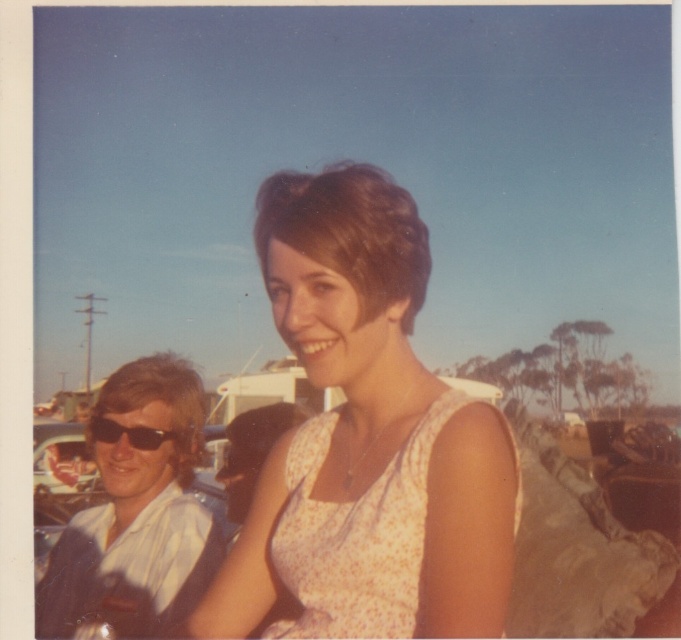
Who is taller, white shirt at left or black plastic sunglasses at left?

white shirt at left is taller.

Is white shirt at left bigger than black plastic sunglasses at left?

Indeed, white shirt at left has a larger size compared to black plastic sunglasses at left.

Is point (185, 563) closer to camera compared to point (114, 440)?

Yes, point (185, 563) is in front of point (114, 440).

Find the location of `white shirt at left`. white shirt at left is located at coordinates (136, 509).

Identify the location of floral cotton dress at center. The height and width of the screenshot is (640, 681). (x=362, y=532).

Between floral cotton dress at center and black plastic sunglasses at left, which one has less height?

black plastic sunglasses at left

Find the location of `floral cotton dress at center`. floral cotton dress at center is located at coordinates (362, 532).

At what (x,y) coordinates should I click in order to perform the action: click on floral cotton dress at center. Please return your answer as a coordinate pair (x, y). The width and height of the screenshot is (681, 640). Looking at the image, I should click on (362, 532).

Is floral fabric dress at center to the right of white shirt at left from the viewer's perspective?

Indeed, floral fabric dress at center is positioned on the right side of white shirt at left.

Can you confirm if floral fabric dress at center is positioned above white shirt at left?

Correct, floral fabric dress at center is located above white shirt at left.

Does point (300, 236) lie in front of point (61, 573)?

Yes, it is in front of point (61, 573).

Identify the location of floral fabric dress at center. (387, 381).